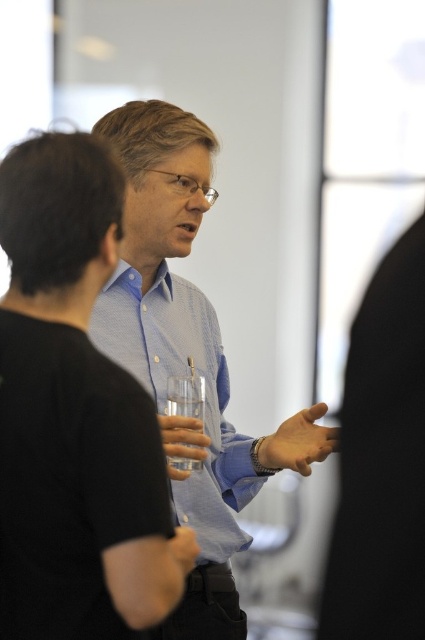
You are a photographer adjusting the lighting for a portrait. The subject is wearing a blue woven shirt at center and has a smooth skin hand at center. To ensure both elements are well lit, which one should you adjust the light intensity for first, considering their size in the frame?

The blue woven shirt at center is much taller than the smooth skin hand at center, so you should adjust the light intensity for the blue woven shirt at center first to account for its larger size in the frame.

You are a photographer adjusting the focus of your camera. You notice the smooth skin hand at center and the clear glass at center in your frame. Which object should you focus on to ensure it appears sharp in the photo?

The smooth skin hand at center is closer to the viewer than the clear glass at center. Since the depth of field is shallow, focusing on the smooth skin hand at center will keep it sharp while the glass may appear slightly blurred.